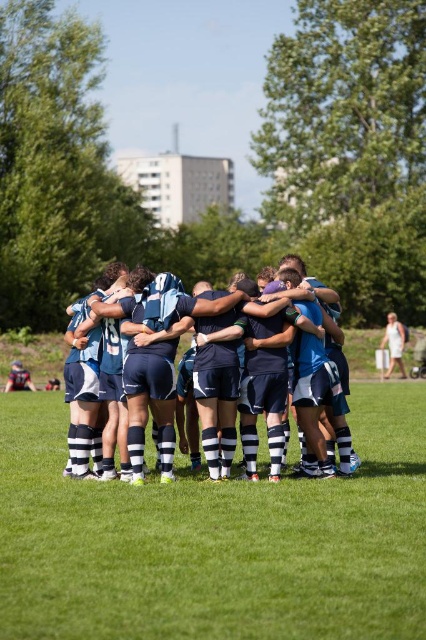
You are a photographer positioned at the edge of the field. You want to capture a photo where the green grass at center is wider than the blue jersey at center. Is this possible?

Yes, because the green grass at center is wider than the blue jersey at center according to the description.

You are standing at the camera position and want to know how far the point at coordinates (391, 593) is from you. Can you determine the distance?

The point at coordinates (391, 593) is 9.17 meters away from the camera position.

You are a drone operator trying to capture an aerial shot of the rugby players. The green grass at center is where the players are huddled. To ensure the players are centered in your shot, should you adjust your camera to focus more on the upper or lower part of the frame?

The green grass at center is located at point coordinates of (215, 540). Since the y coordinate is 0.507, which is slightly above the center point of 0.5, you should adjust your camera to focus slightly on the upper part of the frame to center the players properly.